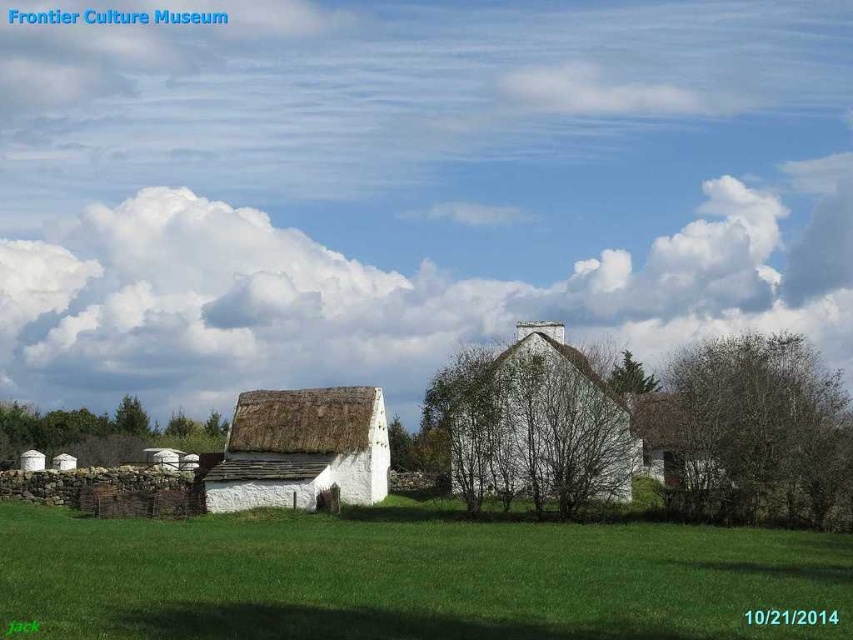
How distant is green grass at lower center from white thatched roof hut at center?

green grass at lower center is 17.25 meters away from white thatched roof hut at center.

Who is positioned more to the left, green grass at lower center or white thatched roof hut at center?

green grass at lower center

Describe the element at coordinates (412, 579) in the screenshot. I see `green grass at lower center` at that location.

Identify the location of green grass at lower center. The image size is (853, 640). (412, 579).

Which is behind, point (503, 413) or point (276, 426)?

The point (276, 426) is behind.

Is white thatched roof hut at center to the right of white thatched roof cottage at center from the viewer's perspective?

Yes, white thatched roof hut at center is to the right of white thatched roof cottage at center.

Describe the element at coordinates (543, 426) in the screenshot. The width and height of the screenshot is (853, 640). I see `white thatched roof hut at center` at that location.

The width and height of the screenshot is (853, 640). What are the coordinates of `white thatched roof hut at center` in the screenshot? It's located at (543, 426).

Is green grass at lower center shorter than white thatched roof cottage at center?

Correct, green grass at lower center is not as tall as white thatched roof cottage at center.

Which is in front, point (415, 561) or point (322, 410)?

Point (415, 561) is more forward.

The height and width of the screenshot is (640, 853). Find the location of `green grass at lower center`. green grass at lower center is located at coordinates (412, 579).